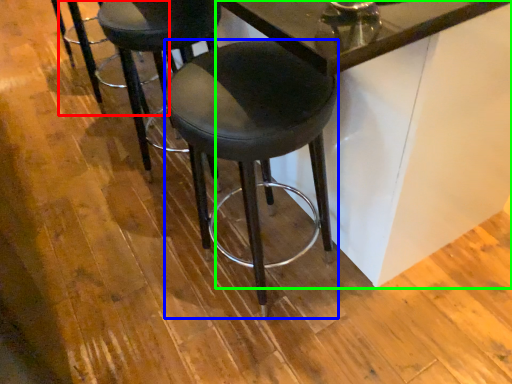
Question: Which object is positioned closest to bar stool (highlighted by a red box)? Select from stool (highlighted by a blue box) and table (highlighted by a green box).

Choices:
 (A) stool
 (B) table

Answer: (A)